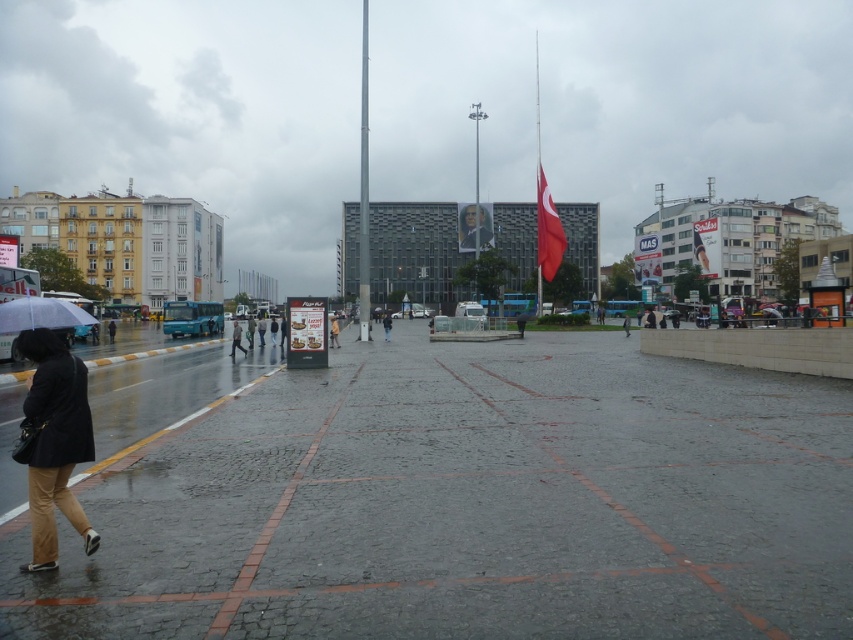
Question: Among these objects, which one is farthest from the camera?

Choices:
 (A) dark gray jacket at lower left
 (B) yellow fabric jacket at center
 (C) red fabric flag at center
 (D) matte black coat at lower left

Answer: (C)

Question: Which of these objects is positioned farthest from the yellow fabric jacket at center?

Choices:
 (A) red fabric flag at center
 (B) black matte jacket at center
 (C) black matte jacket at lower left
 (D) gray cobblestone pavement at center

Answer: (A)

Question: Is transparent plastic umbrella at lower left further to camera compared to red fabric flag at center?

Choices:
 (A) no
 (B) yes

Answer: (A)

Question: Which object is farther from the camera taking this photo?

Choices:
 (A) yellow fabric jacket at center
 (B) black matte jacket at lower left

Answer: (B)

Question: Observing the image, what is the correct spatial positioning of matte black coat at lower left in reference to black matte jacket at lower left?

Choices:
 (A) right
 (B) left

Answer: (A)

Question: Is gray cobblestone pavement at center wider than dark gray jacket at lower left?

Choices:
 (A) yes
 (B) no

Answer: (A)